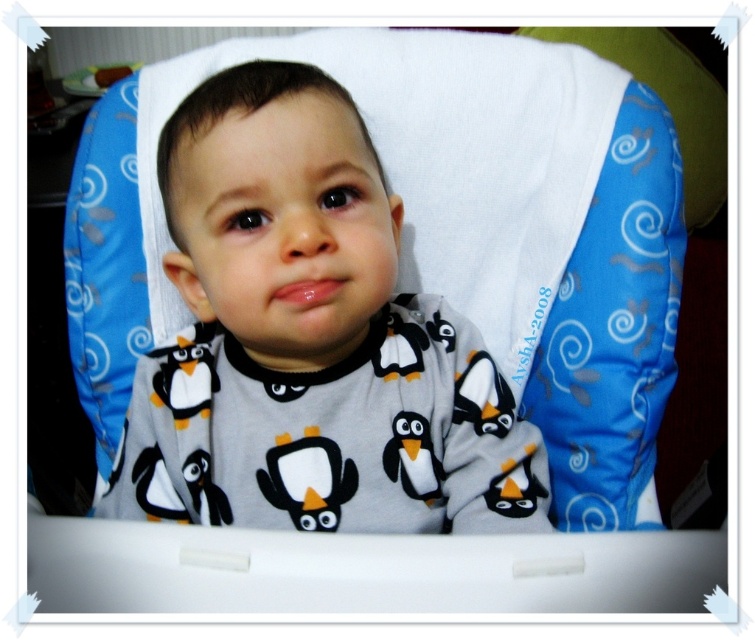
Does black fabric penguin at center have a greater width compared to white plush penguin at center?

Correct, the width of black fabric penguin at center exceeds that of white plush penguin at center.

Does black fabric penguin at center have a lesser height compared to white plush penguin at center?

In fact, black fabric penguin at center may be taller than white plush penguin at center.

You are a GUI agent. You are given a task and a screenshot of the screen. Output one action in this format:
    pyautogui.click(x=<x>, y=<y>)
    Task: Click on the black fabric penguin at center
    The height and width of the screenshot is (640, 755).
    Given the screenshot: What is the action you would take?
    pyautogui.click(x=307, y=480)

The width and height of the screenshot is (755, 640). I want to click on gray fleece pajamas at center, so click(307, 328).

Is gray fleece pajamas at center smaller than white plush penguin at center?

No.

Is point (223, 520) in front of point (390, 464)?

That is False.

Locate an element on the screen. The image size is (755, 640). gray fleece pajamas at center is located at coordinates (307, 328).

Is gray fleece pajamas at center further to camera compared to black fabric penguin at center?

No.

Can you confirm if gray fleece pajamas at center is wider than black fabric penguin at center?

Correct, the width of gray fleece pajamas at center exceeds that of black fabric penguin at center.

Find the location of a particular element. This screenshot has width=755, height=640. gray fleece pajamas at center is located at coordinates [307, 328].